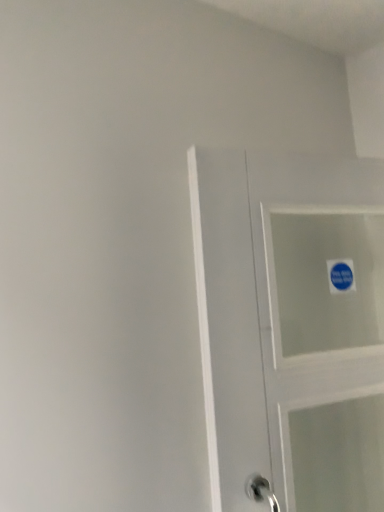
Question: Does point (309, 260) appear closer or farther from the camera than point (340, 270)?

Choices:
 (A) farther
 (B) closer

Answer: (A)

Question: Would you say white glossy door at center is to the left or to the right of blue paper sticker at upper right in the picture?

Choices:
 (A) left
 (B) right

Answer: (A)

Question: From a real-world perspective, is white glossy door at center above or below blue paper sticker at upper right?

Choices:
 (A) below
 (B) above

Answer: (A)

Question: Choose the correct answer: Is blue paper sticker at upper right inside white glossy door at center or outside it?

Choices:
 (A) inside
 (B) outside

Answer: (A)

Question: Considering the positions of blue paper sticker at upper right and white glossy door at center in the image, is blue paper sticker at upper right wider or thinner than white glossy door at center?

Choices:
 (A) wide
 (B) thin

Answer: (B)

Question: From a real-world perspective, relative to white glossy door at center, is blue paper sticker at upper right vertically above or below?

Choices:
 (A) above
 (B) below

Answer: (A)

Question: Is blue paper sticker at upper right in front of or behind white glossy door at center in the image?

Choices:
 (A) behind
 (B) front

Answer: (A)